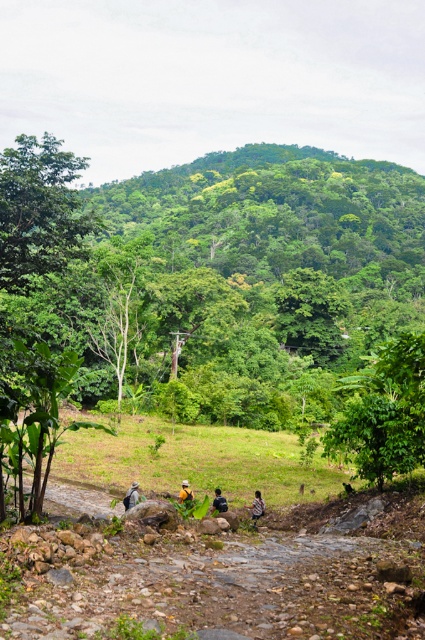
You are a hiker planning to take a photo of both the green leafy tree at lower right and the striped shirt at lower center. Since you want both subjects in the frame, will you need to adjust your camera angle upwards or downwards?

The green leafy tree at lower right is much taller than the striped shirt at lower center, so you will need to adjust your camera angle upwards to include both subjects in the frame.

You are a hiker standing at the point marked as point (186, 493) in the image. Looking around, you see a rocky path and scattered rocks. What object is directly beneath your feet?

The point (186, 493) is on yellow fabric shirt at center, so the yellow fabric shirt at center is directly beneath your feet.

You are a hiker trying to navigate a rocky path in the image. You need to move from the striped shirt at lower center to the green leafy tree at lower right. Given that your hiking boots have a maximum grip capacity for paths with a slope of up to 15 degrees, can you safely traverse the 11.27 meters between them without slipping?

The distance between the green leafy tree at lower right and striped shirt at lower center is 11.27 meters. However, the question of slope and safety depends on the terrain between them, which isnecessary to determine if the slope exceeds 15 degrees. Since the provided information does not include details about the slope or terrain steepness between these two points, I cannot confirm if the path is safe for your hiking boots with a 15 degree limit.